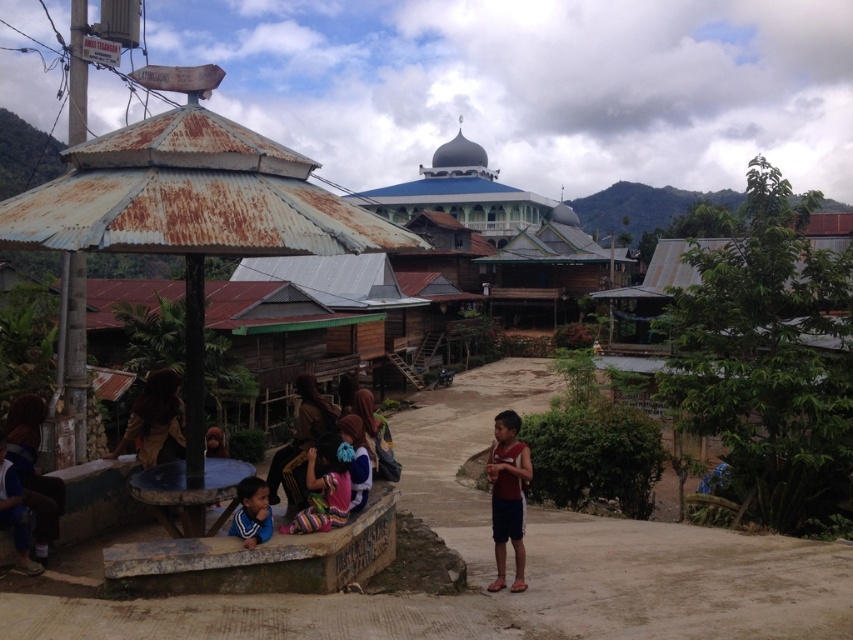
You are planning to place a new bench in the village scene. The bench is 1.5 meters wide. You have two options for placement locations. One is next to the rusty metal hut at left, and the other is near the multicolored fabric at center. Based on their widths, which location would allow the bench to fit better without overcrowding the area?

The rusty metal hut at left is wider than the multicolored fabric at center. Since the bench is 1.5 meters wide, placing it next to the rusty metal hut at left would provide more space and prevent overcrowding compared to the narrower area near the multicolored fabric at center.

You are standing at the center of the dirt path in the midground of the village scene. You see a point marked at coordinates (251, 513). What object is located at that point?

The point at coordinates (251, 513) corresponds to the matte blue shirt at lower left.